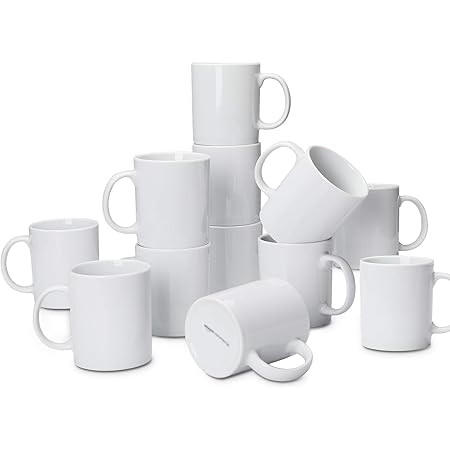
Image resolution: width=450 pixels, height=450 pixels. What are the coordinates of `mugs sitting on another mug` in the screenshot? It's located at (180, 202), (230, 190), (226, 106), (310, 192).